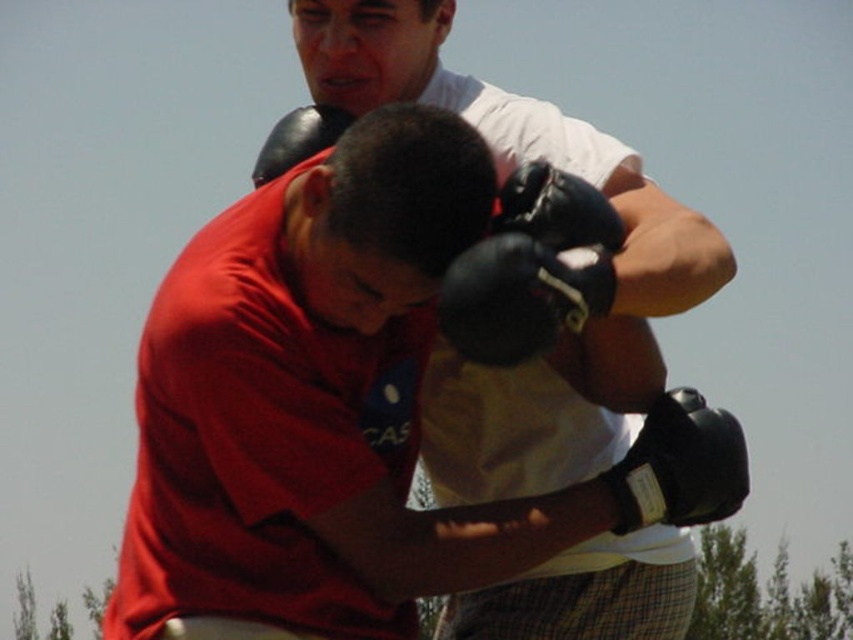
Question: Is black leather boxing glove at center bigger than black synthetic glove at lower right?

Choices:
 (A) no
 (B) yes

Answer: (B)

Question: Does matte black gloves at upper center appear on the right side of black leather boxing glove at center?

Choices:
 (A) yes
 (B) no

Answer: (A)

Question: Is black leather boxing glove at center to the right of black synthetic glove at lower right from the viewer's perspective?

Choices:
 (A) yes
 (B) no

Answer: (B)

Question: Which point appears farthest from the camera in this image?

Choices:
 (A) (553, 129)
 (B) (650, 468)
 (C) (602, 212)

Answer: (A)

Question: Which point is closer to the camera?

Choices:
 (A) black synthetic glove at lower right
 (B) black leather boxing glove at center

Answer: (B)

Question: Estimate the real-world distances between objects in this image. Which object is closer to the matte black gloves at upper center?

Choices:
 (A) black leather boxing glove at center
 (B) black synthetic glove at lower right

Answer: (A)